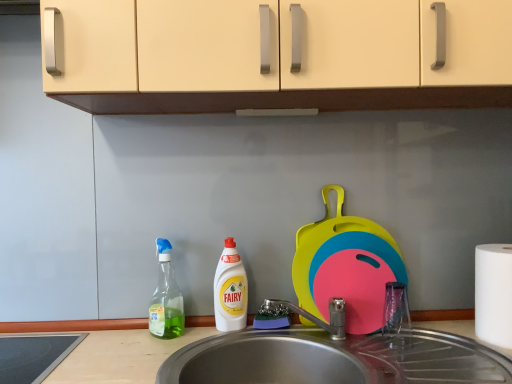
You are a GUI agent. You are given a task and a screenshot of the screen. Output one action in this format:
    pyautogui.click(x=<x>, y=<y>)
    Task: Click on the blank space above metallic stainless steel sink at lower center (from a real-world perspective)
    Image resolution: width=512 pixels, height=384 pixels.
    Given the screenshot: What is the action you would take?
    pyautogui.click(x=382, y=352)